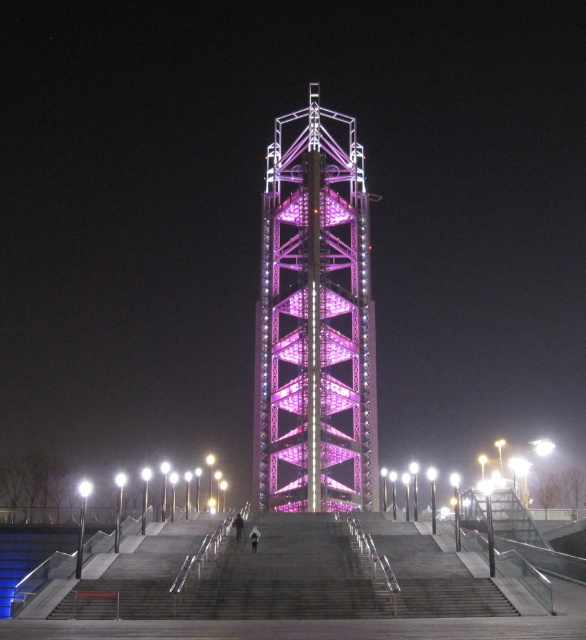
Does point (359, 412) come in front of point (152, 593)?

No.

Who is positioned more to the left, purple metallic bell tower at center or pink metallic tower at center?

pink metallic tower at center

Describe the element at coordinates (315, 321) in the screenshot. I see `purple metallic bell tower at center` at that location.

The width and height of the screenshot is (586, 640). I want to click on purple metallic bell tower at center, so click(x=315, y=321).

Is purple metallic bell tower at center positioned at the back of gray concrete stairs at center?

Yes.

Who is positioned more to the left, purple metallic bell tower at center or gray concrete stairs at center?

From the viewer's perspective, gray concrete stairs at center appears more on the left side.

Where is `purple metallic bell tower at center`? Image resolution: width=586 pixels, height=640 pixels. purple metallic bell tower at center is located at coordinates (315, 321).

Which is below, pink metallic tower at center or gray concrete stairs at center?

pink metallic tower at center is lower down.

Is point (449, 554) behind point (410, 596)?

That is True.

Locate an element on the screen. This screenshot has height=640, width=586. pink metallic tower at center is located at coordinates (287, 576).